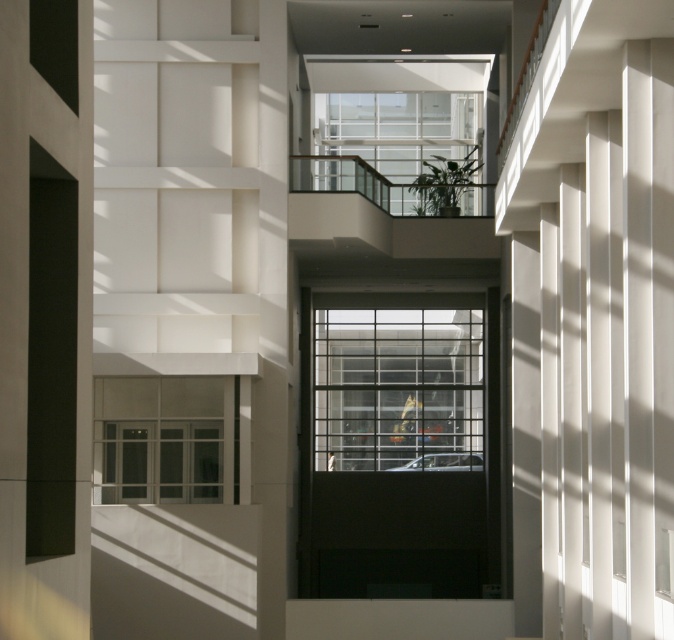
You are standing in the atrium and want to take a photo of the point at coordinates point (398, 397). If your camera has a maximum focus range of 150 feet, will you be able to focus on it?

The point (398, 397) is 143.25 feet from the camera, which is within the 150 feet maximum focus range. Therefore, the camera can focus on it.

You are standing in the modern architectural space described. You want to look through the clear glass window at center. In which direction should you move to get closer to it?

The clear glass window at center is located at point coordinates (x=398, y=388). Since the window is at the center of the image, you should move towards the center of the space to get closer to it.